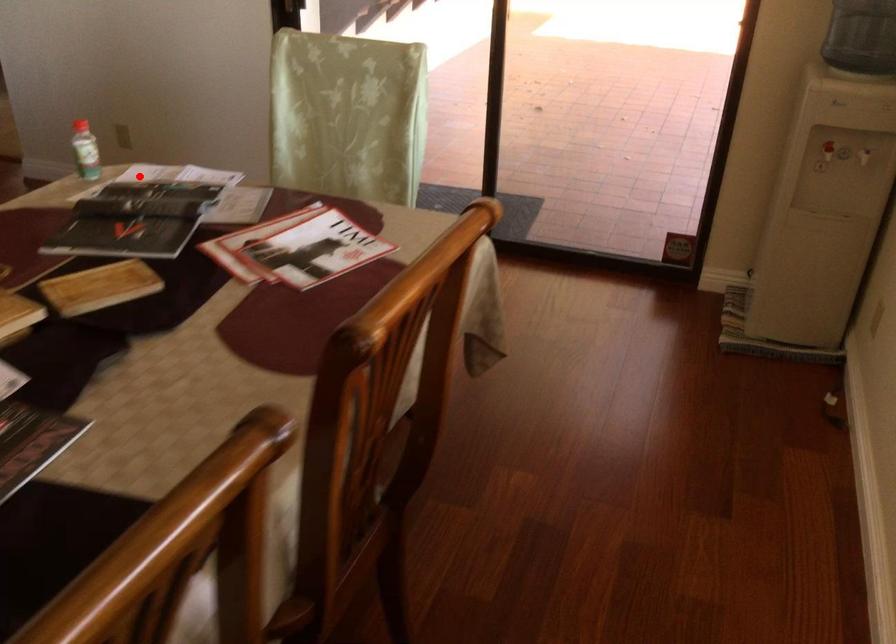
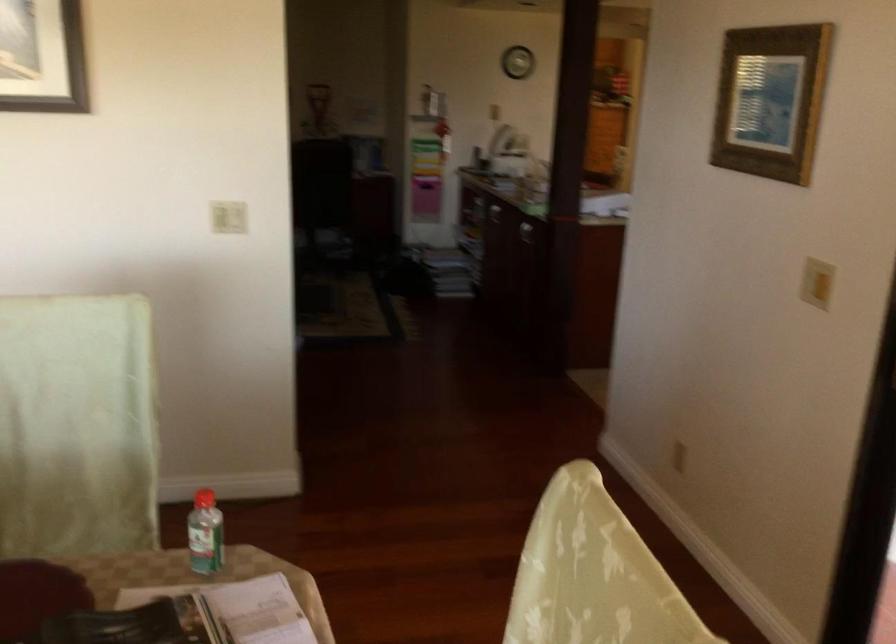
Question: I am providing you with two images of the same scene from different viewpoints. A red point is shown in image1. For the corresponding object point in image2, is it positioned nearer or farther from the camera?

Choices:
 (A) Nearer
 (B) Farther

Answer: (A)